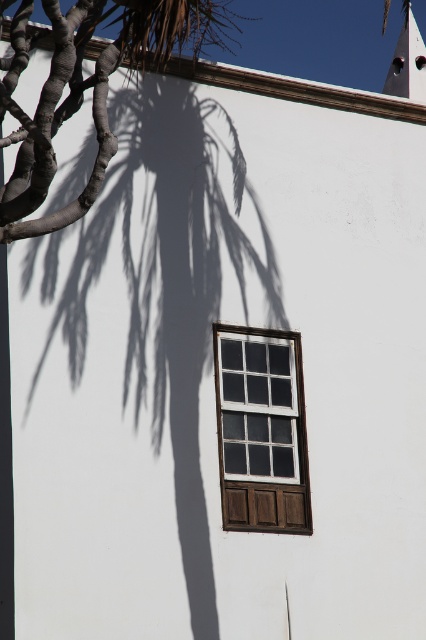
You are standing in front of the white wall and notice the brown textured trunk at left and the white wood window at center. Which object is closer to you based on their positions?

The brown textured trunk at left is closer to you because it is positioned over the white wood window at center, indicating it is in front of it.

You are an artist planning to paint a mural on the white wall. The brown textured trunk at left and the white wood window at center are in your way. Which object should you move first if you want to start painting the area closest to you?

The brown textured trunk at left should be moved first because it is larger in size than the white wood window at center, making it a bigger obstruction closer to you.